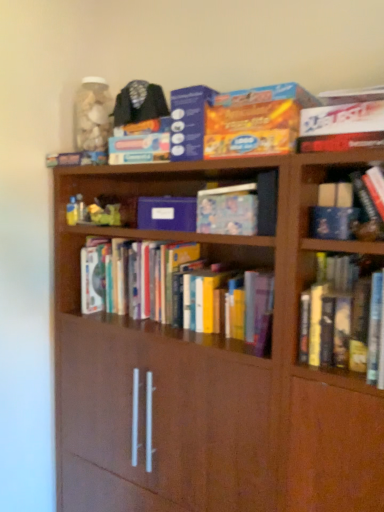
The image size is (384, 512). Identify the location of brown wood bookcase at center. 217,352.

Image resolution: width=384 pixels, height=512 pixels. What do you see at coordinates (188, 121) in the screenshot?
I see `matte cardboard box at upper center, positioned as the 3th paperback book in bottom-to-top order` at bounding box center [188, 121].

Image resolution: width=384 pixels, height=512 pixels. What do you see at coordinates (239, 208) in the screenshot? I see `matte blue book at center, the first book in the top-to-bottom sequence` at bounding box center [239, 208].

Measure the distance between hardcover books at center, placed as the 1th book when sorted from bottom to top, and camera.

hardcover books at center, placed as the 1th book when sorted from bottom to top, is 1.27 meters from camera.

I want to click on brown wood bookcase at center, so click(217, 352).

Is blue matte paper at center, which is the 3th paperback book from top to bottom, closer to the viewer compared to matte cardboard box at upper center, positioned as the 3th paperback book in bottom-to-top order?

No, blue matte paper at center, which is the 3th paperback book from top to bottom, is behind matte cardboard box at upper center, positioned as the 3th paperback book in bottom-to-top order.

Could you measure the distance between blue matte paper at center, which is the 3th paperback book from top to bottom, and matte cardboard box at upper center, which appears as the first paperback book when viewed from the top?

blue matte paper at center, which is the 3th paperback book from top to bottom, is 21.73 centimeters from matte cardboard box at upper center, which appears as the first paperback book when viewed from the top.

Looking at their sizes, would you say blue matte paper at center, the 1th paperback book positioned from the bottom, is wider or thinner than matte cardboard box at upper center, which appears as the first paperback book when viewed from the top?

In the image, blue matte paper at center, the 1th paperback book positioned from the bottom, appears to be more narrow than matte cardboard box at upper center, which appears as the first paperback book when viewed from the top.

From a real-world perspective, which object stands above the other?

From a 3D spatial view, matte cardboard box at upper center, which appears as the first paperback book when viewed from the top, is above.

From a real-world perspective, which is physically below, matte blue book at center, the 2th book in the bottom-to-top sequence, or matte cardboard box at upper center, which appears as the first paperback book when viewed from the top?

matte blue book at center, the 2th book in the bottom-to-top sequence, from a real-world perspective.

How different are the orientations of matte blue book at center, the first book in the top-to-bottom sequence, and matte cardboard box at upper center, which appears as the first paperback book when viewed from the top, in degrees?

The angle between the facing direction of matte blue book at center, the first book in the top-to-bottom sequence, and the facing direction of matte cardboard box at upper center, which appears as the first paperback book when viewed from the top, is 1.03 degrees.

Is matte blue book at center, the first book in the top-to-bottom sequence, taller or shorter than matte cardboard box at upper center, which appears as the first paperback book when viewed from the top?

Clearly, matte blue book at center, the first book in the top-to-bottom sequence, is shorter compared to matte cardboard box at upper center, which appears as the first paperback book when viewed from the top.

Between brown wood bookcase at center and matte blue book at center, the first book in the top-to-bottom sequence, which one has larger size?

brown wood bookcase at center is bigger.

How distant is brown wood bookcase at center from matte blue book at center, the 2th book in the bottom-to-top sequence?

A distance of 16.74 inches exists between brown wood bookcase at center and matte blue book at center, the 2th book in the bottom-to-top sequence.

From their relative heights in the image, would you say brown wood bookcase at center is taller or shorter than matte blue book at center, the first book in the top-to-bottom sequence?

brown wood bookcase at center is taller than matte blue book at center, the first book in the top-to-bottom sequence.

From the image's perspective, between brown wood bookcase at center and matte blue book at center, the 2th book in the bottom-to-top sequence, who is located below?

brown wood bookcase at center appears lower in the image.

Which is further, (196, 159) or (266, 351)?

The point (196, 159) is farther from the camera.

The height and width of the screenshot is (512, 384). I want to click on paperback book that is the 3rd one when counting upward from the brown wood bookcase at center (from the image's perspective), so click(188, 121).

Which of these two, matte cardboard box at upper center, positioned as the 3th paperback book in bottom-to-top order, or brown wood bookcase at center, is thinner?

matte cardboard box at upper center, positioned as the 3th paperback book in bottom-to-top order, is thinner.

From the image's perspective, is brown wood bookcase at center positioned above or below matte cardboard box at upper center, positioned as the 3th paperback book in bottom-to-top order?

brown wood bookcase at center is below matte cardboard box at upper center, positioned as the 3th paperback book in bottom-to-top order.

From a real-world perspective, count 3rd paperback books upward from the brown wood bookcase at center and point to it. Please provide its 2D coordinates.

[(188, 121)]

Is brown wood bookcase at center looking in the opposite direction of matte cardboard box at upper center, positioned as the 3th paperback book in bottom-to-top order?

No, matte cardboard box at upper center, positioned as the 3th paperback book in bottom-to-top order, is not at the back of brown wood bookcase at center.

Is brown wood bookcase at center outside of matte cardboard box at upper center, positioned as the 3th paperback book in bottom-to-top order?

brown wood bookcase at center lies outside matte cardboard box at upper center, positioned as the 3th paperback book in bottom-to-top order,'s area.

Looking at their sizes, would you say matte cardboard box at upper center, which appears as the first paperback book when viewed from the top, is wider or thinner than matte blue book at center, the 2th book in the bottom-to-top sequence?

Considering their sizes, matte cardboard box at upper center, which appears as the first paperback book when viewed from the top, looks broader than matte blue book at center, the 2th book in the bottom-to-top sequence.

From a real-world perspective, who is located lower, matte cardboard box at upper center, which appears as the first paperback book when viewed from the top, or matte blue book at center, the 2th book in the bottom-to-top sequence?

In real-world perspective, matte blue book at center, the 2th book in the bottom-to-top sequence, is lower.

Is matte cardboard box at upper center, which appears as the first paperback book when viewed from the top, positioned with its back to matte blue book at center, the first book in the top-to-bottom sequence?

No, matte blue book at center, the first book in the top-to-bottom sequence, is not at the back of matte cardboard box at upper center, which appears as the first paperback book when viewed from the top.

Is brown wood bookcase at center not close to hardcover books at center, acting as the second book starting from the top?

No.

Is brown wood bookcase at center bigger than hardcover books at center, placed as the 1th book when sorted from bottom to top?

Indeed, brown wood bookcase at center has a larger size compared to hardcover books at center, placed as the 1th book when sorted from bottom to top.

Considering the relative positions of brown wood bookcase at center and hardcover books at center, acting as the second book starting from the top, in the image provided, is brown wood bookcase at center to the left of hardcover books at center, acting as the second book starting from the top, from the viewer's perspective?

In fact, brown wood bookcase at center is to the right of hardcover books at center, acting as the second book starting from the top.

Where is `paperback book behind the matte cardboard box at upper center, positioned as the 3th paperback book in bottom-to-top order`? Image resolution: width=384 pixels, height=512 pixels. paperback book behind the matte cardboard box at upper center, positioned as the 3th paperback book in bottom-to-top order is located at coordinates (167, 213).

This screenshot has height=512, width=384. In order to click on book that is the 1st one below the matte cardboard box at upper center, positioned as the 3th paperback book in bottom-to-top order (from a real-world perspective) in this screenshot , I will do `click(239, 208)`.

Based on their spatial positions, is matte cardboard box at upper center, the 2th paperback book when ordered from top to bottom, or blue matte paper at center, which is the 3th paperback book from top to bottom, further from brown wood bookcase at center?

matte cardboard box at upper center, the 2th paperback book when ordered from top to bottom, is positioned further to the anchor brown wood bookcase at center.

From the image, which object appears to be farther from matte blue book at center, the first book in the top-to-bottom sequence, brown wood bookcase at center or blue matte paper at center, which is the 3th paperback book from top to bottom?

brown wood bookcase at center is positioned further to the anchor matte blue book at center, the first book in the top-to-bottom sequence.

Considering their positions, is matte cardboard box at upper center, the 2th paperback book when ordered from top to bottom, positioned further to matte cardboard box at upper center, which appears as the first paperback book when viewed from the top, than matte blue book at center, the 2th book in the bottom-to-top sequence?

Based on the image, matte blue book at center, the 2th book in the bottom-to-top sequence, appears to be further to matte cardboard box at upper center, which appears as the first paperback book when viewed from the top.

When comparing their distances from matte cardboard box at upper center, the 2th paperback book when ordered from top to bottom, does matte cardboard box at upper center, which appears as the first paperback book when viewed from the top, or matte blue book at center, the 2th book in the bottom-to-top sequence, seem closer?

matte cardboard box at upper center, which appears as the first paperback book when viewed from the top, is positioned closer to the anchor matte cardboard box at upper center, the 2th paperback book when ordered from top to bottom.

Based on their spatial positions, is blue matte paper at center, which is the 3th paperback book from top to bottom, or matte cardboard box at upper center, which appears as the first paperback book when viewed from the top, closer to matte cardboard box at upper center, the second paperback book ordered from the bottom?

Based on the image, matte cardboard box at upper center, which appears as the first paperback book when viewed from the top, appears to be nearer to matte cardboard box at upper center, the second paperback book ordered from the bottom.

Based on their spatial positions, is brown wood bookcase at center or matte blue book at center, the 2th book in the bottom-to-top sequence, further from matte cardboard box at upper center, the 2th paperback book when ordered from top to bottom?

The object further to matte cardboard box at upper center, the 2th paperback book when ordered from top to bottom, is brown wood bookcase at center.

Which object lies nearer to the anchor point matte blue book at center, the first book in the top-to-bottom sequence, matte cardboard box at upper center, the 2th paperback book when ordered from top to bottom, or hardcover books at center, placed as the 1th book when sorted from bottom to top?

matte cardboard box at upper center, the 2th paperback book when ordered from top to bottom.

Which object lies nearer to the anchor point matte cardboard box at upper center, positioned as the 3th paperback book in bottom-to-top order, matte blue book at center, the 2th book in the bottom-to-top sequence, or hardcover books at center, acting as the second book starting from the top?

matte blue book at center, the 2th book in the bottom-to-top sequence, is closer to matte cardboard box at upper center, positioned as the 3th paperback book in bottom-to-top order.

Where is `book between matte cardboard box at upper center, positioned as the 3th paperback book in bottom-to-top order, and hardcover books at center, acting as the second book starting from the top, in the vertical direction`? The height and width of the screenshot is (512, 384). book between matte cardboard box at upper center, positioned as the 3th paperback book in bottom-to-top order, and hardcover books at center, acting as the second book starting from the top, in the vertical direction is located at coordinates (239, 208).

The width and height of the screenshot is (384, 512). What are the coordinates of `paperback book between matte blue book at center, the first book in the top-to-bottom sequence, and hardcover books at center, placed as the 1th book when sorted from bottom to top, in the vertical direction` in the screenshot? It's located at (167, 213).

Identify the location of paperback book between matte cardboard box at upper center, the 2th paperback book when ordered from top to bottom, and hardcover books at center, acting as the second book starting from the top, in the up-down direction. (167, 213).

Find the location of a particular element. paperback book between matte cardboard box at upper center, which appears as the first paperback book when viewed from the top, and matte blue book at center, the 2th book in the bottom-to-top sequence, vertically is located at coordinates (255, 121).